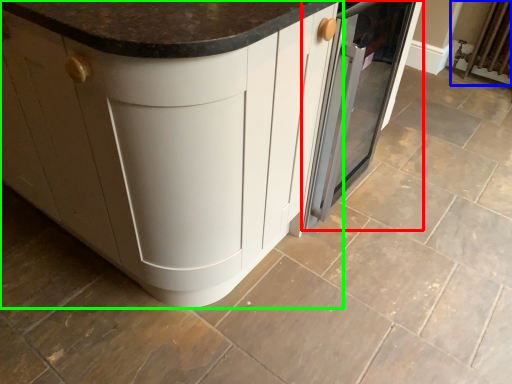
Question: Estimate the real-world distances between objects in this image. Which object is farther from home appliance (highlighted by a red box), radiator (highlighted by a blue box) or cabinetry (highlighted by a green box)?

Choices:
 (A) radiator
 (B) cabinetry

Answer: (A)